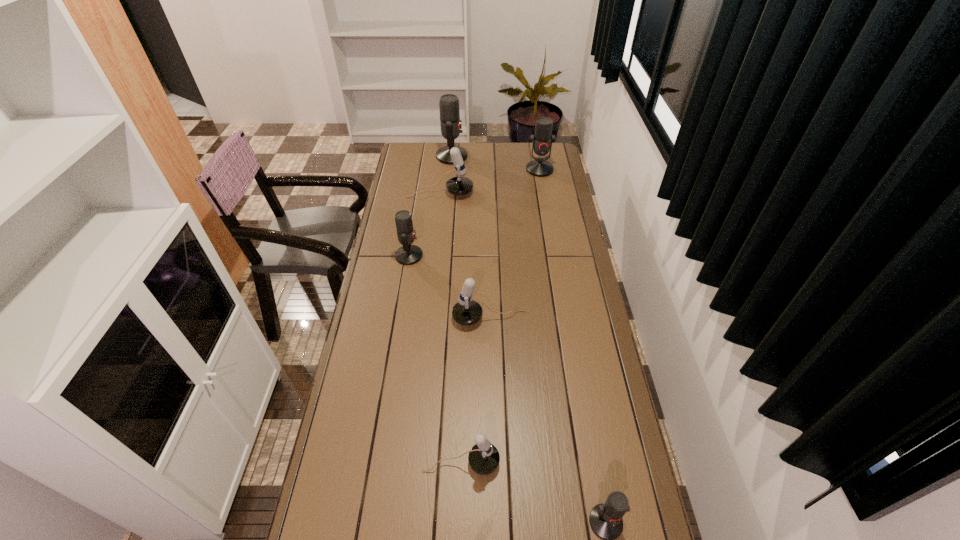
This screenshot has width=960, height=540. Identify the location of red microphone that is the nearest to the fifth farthest object. (408, 254).

I want to click on red microphone object that ranks as the third closest to the third smallest red microphone, so click(605, 519).

I want to click on the second closest white microphone to the second biggest red microphone, so click(x=466, y=311).

Identify which white microphone is the second closest to the second farthest white microphone. Please provide its 2D coordinates. Your answer should be formatted as a tuple, i.e. [(x, y)], where the tuple contains the x and y coordinates of a point satisfying the conditions above.

[(458, 185)]

Where is `vacant area that satisfies the following two spatial constraints: 1. on the side of the third nearest object with the red ring; 2. on the left side of the biggest red microphone`? vacant area that satisfies the following two spatial constraints: 1. on the side of the third nearest object with the red ring; 2. on the left side of the biggest red microphone is located at coordinates (438, 319).

What are the coordinates of `vacant space that satisfies the following two spatial constraints: 1. on the side of the smallest white microphone with the red ring; 2. on the left side of the fourth nearest microphone` in the screenshot? It's located at (375, 462).

The height and width of the screenshot is (540, 960). What are the coordinates of `free space that satisfies the following two spatial constraints: 1. on the side of the fifth farthest microphone with the red ring; 2. on the right side of the fourth farthest microphone` in the screenshot? It's located at (398, 319).